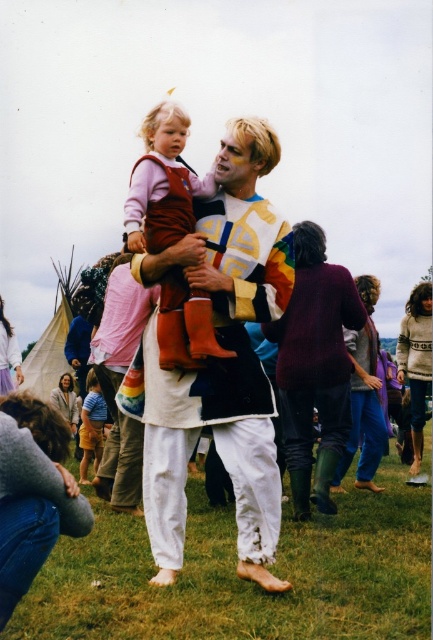
Does white cotton pants at center have a lesser width compared to striped cotton shirt at lower left?

Incorrect, white cotton pants at center's width is not less than striped cotton shirt at lower left's.

Which is more to the left, white cotton pants at center or striped cotton shirt at lower left?

From the viewer's perspective, striped cotton shirt at lower left appears more on the left side.

Measure the distance between white cotton pants at center and camera.

A distance of 14.20 meters exists between white cotton pants at center and camera.

At what (x,y) coordinates should I click in order to perform the action: click on white cotton pants at center. Please return your answer as a coordinate pair (x, y). Looking at the image, I should click on (217, 360).

Is gray fabric shoulder at lower left taller than striped cotton shirt at lower left?

Yes, gray fabric shoulder at lower left is taller than striped cotton shirt at lower left.

This screenshot has height=640, width=433. What do you see at coordinates (32, 493) in the screenshot? I see `gray fabric shoulder at lower left` at bounding box center [32, 493].

What do you see at coordinates (32, 493) in the screenshot?
I see `gray fabric shoulder at lower left` at bounding box center [32, 493].

Where is `gray fabric shoulder at lower left`? Image resolution: width=433 pixels, height=640 pixels. gray fabric shoulder at lower left is located at coordinates (32, 493).

Who is more distant from viewer, (183, 259) or (144, 125)?

The point (144, 125) is behind.

Does white cotton pants at center appear over velvet maroon boots at center?

No, white cotton pants at center is not above velvet maroon boots at center.

Where is `white cotton pants at center`? Image resolution: width=433 pixels, height=640 pixels. white cotton pants at center is located at coordinates (217, 360).